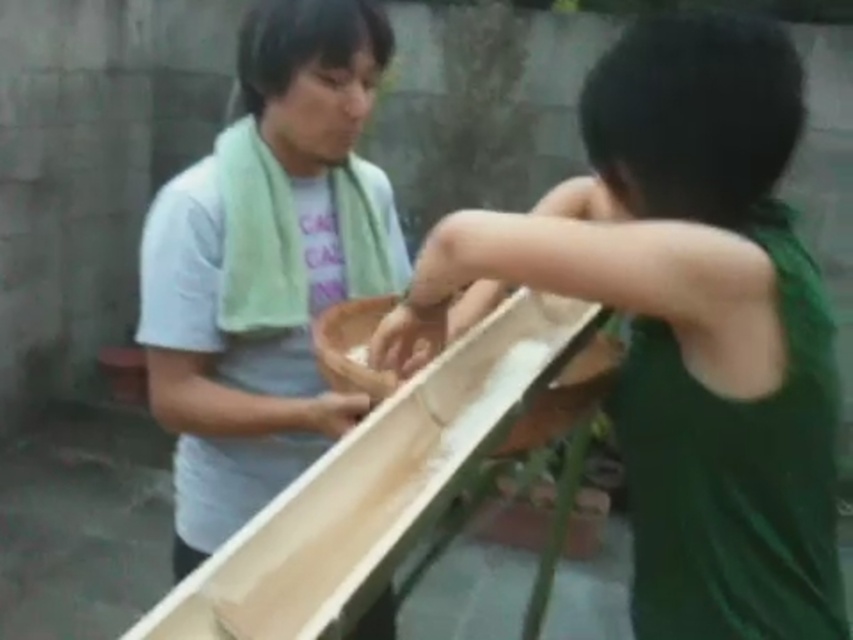
Question: Which object appears farthest from the camera in this image?

Choices:
 (A) smooth wooden trough at center
 (B) green fabric shirt at right

Answer: (B)

Question: Can you confirm if green fabric shirt at right is positioned to the left of smooth wooden trough at center?

Choices:
 (A) yes
 (B) no

Answer: (B)

Question: Can you confirm if green fabric shirt at right is smaller than smooth wooden trough at center?

Choices:
 (A) yes
 (B) no

Answer: (B)

Question: Is green fabric shirt at right closer to the viewer compared to smooth wooden trough at center?

Choices:
 (A) no
 (B) yes

Answer: (A)